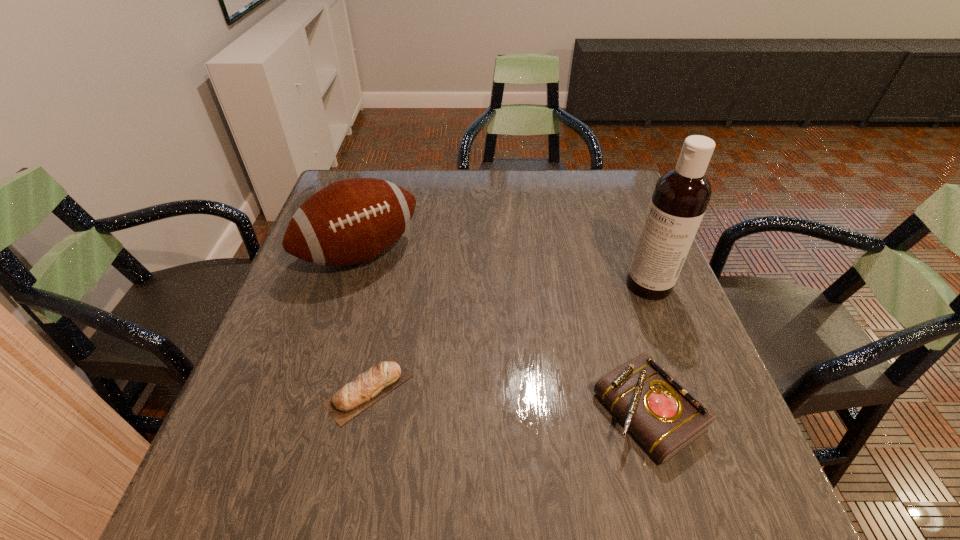
Locate an element on the screen. This screenshot has width=960, height=540. unoccupied position between the second tallest object and the pita bread is located at coordinates (365, 321).

Where is `free spot between the pita bread and the second shortest object`? Image resolution: width=960 pixels, height=540 pixels. free spot between the pita bread and the second shortest object is located at coordinates (509, 401).

In order to click on free space between the dishwasher detergent and the second shortest object in this screenshot , I will do `click(648, 348)`.

At what (x,y) coordinates should I click in order to perform the action: click on vacant space that is in between the tallest object and the shortest object. Please return your answer as a coordinate pair (x, y). The width and height of the screenshot is (960, 540). Looking at the image, I should click on (509, 337).

Find the location of a particular element. This screenshot has width=960, height=540. unoccupied position between the diary and the tallest object is located at coordinates (648, 348).

Locate an element on the screen. the third closest object to the diary is located at coordinates (351, 221).

Identify which object is located as the nearest to the diary. Please provide its 2D coordinates. Your answer should be formatted as a tuple, i.e. [(x, y)], where the tuple contains the x and y coordinates of a point satisfying the conditions above.

[(681, 195)]

Find the location of a particular element. This screenshot has width=960, height=540. vacant space that satisfies the following two spatial constraints: 1. on the front side of the football; 2. on the right side of the second shortest object is located at coordinates (314, 412).

The height and width of the screenshot is (540, 960). I want to click on vacant space that satisfies the following two spatial constraints: 1. on the front side of the tallest object; 2. on the left side of the third shortest object, so click(351, 285).